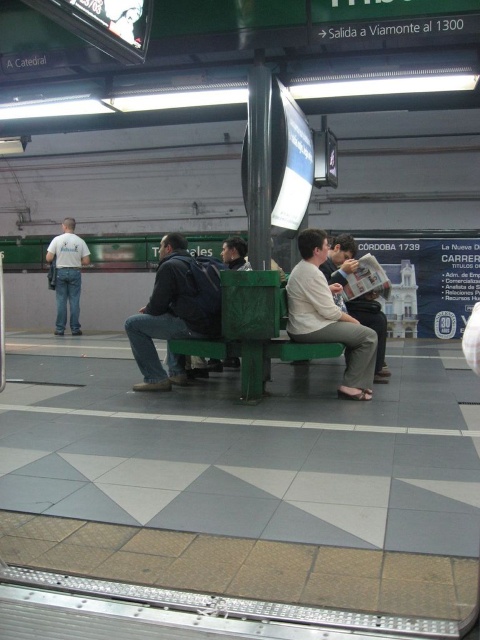
Question: Is green matte bench at center bigger than light blue jeans at left?

Choices:
 (A) no
 (B) yes

Answer: (B)

Question: Can you confirm if light beige fabric shirt at center is positioned below light blue jeans at left?

Choices:
 (A) yes
 (B) no

Answer: (A)

Question: Is dark blue jeans at center positioned behind light brown leather jacket at center?

Choices:
 (A) yes
 (B) no

Answer: (B)

Question: Which point is closer to the camera?

Choices:
 (A) (330, 275)
 (B) (151, 365)
 (C) (324, 259)

Answer: (C)

Question: Among these points, which one is nearest to the camera?

Choices:
 (A) (328, 292)
 (B) (323, 266)

Answer: (A)

Question: Which point is farther from the camera taking this photo?

Choices:
 (A) (212, 269)
 (B) (335, 253)
 (C) (254, 291)

Answer: (B)